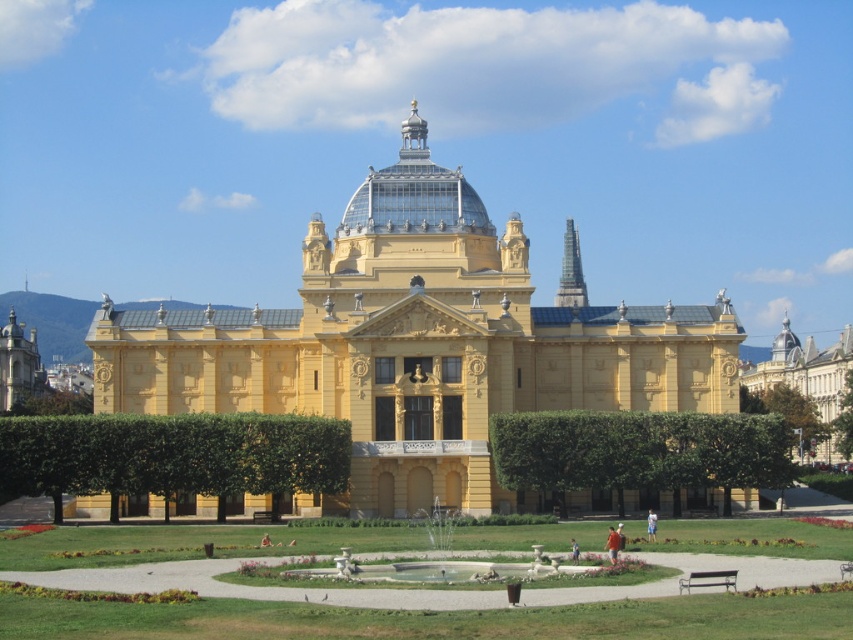
In the scene shown: Which of these two, yellow stone building at right or blue fabric shirt at center, stands shorter?

Standing shorter between the two is blue fabric shirt at center.

Can you confirm if yellow stone building at right is positioned above blue fabric shirt at center?

Result: Indeed, yellow stone building at right is positioned over blue fabric shirt at center.

Describe the element at coordinates (804, 369) in the screenshot. I see `yellow stone building at right` at that location.

What are the coordinates of `yellow stone building at right` in the screenshot? It's located at (804, 369).

Does yellow matte building at center have a smaller size compared to orange fabric person at center?

Actually, yellow matte building at center might be larger than orange fabric person at center.

Is yellow matte building at center wider than orange fabric person at center?

Correct, the width of yellow matte building at center exceeds that of orange fabric person at center.

Is point (378, 500) positioned before point (610, 556)?

No, it is not.

Where is `yellow matte building at center`? This screenshot has height=640, width=853. yellow matte building at center is located at coordinates (418, 342).

Does green leafy hedge at lower center lie behind yellow stone building at right?

No, green leafy hedge at lower center is closer to the viewer.

Where is `green leafy hedge at lower center`? green leafy hedge at lower center is located at coordinates (171, 456).

Find the location of a particular element. The image size is (853, 640). green leafy hedge at lower center is located at coordinates (171, 456).